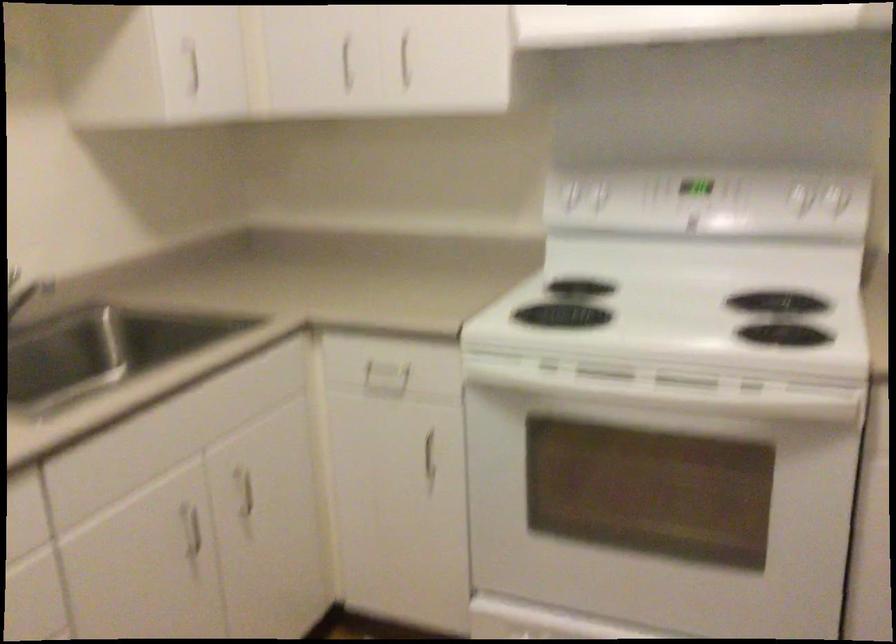
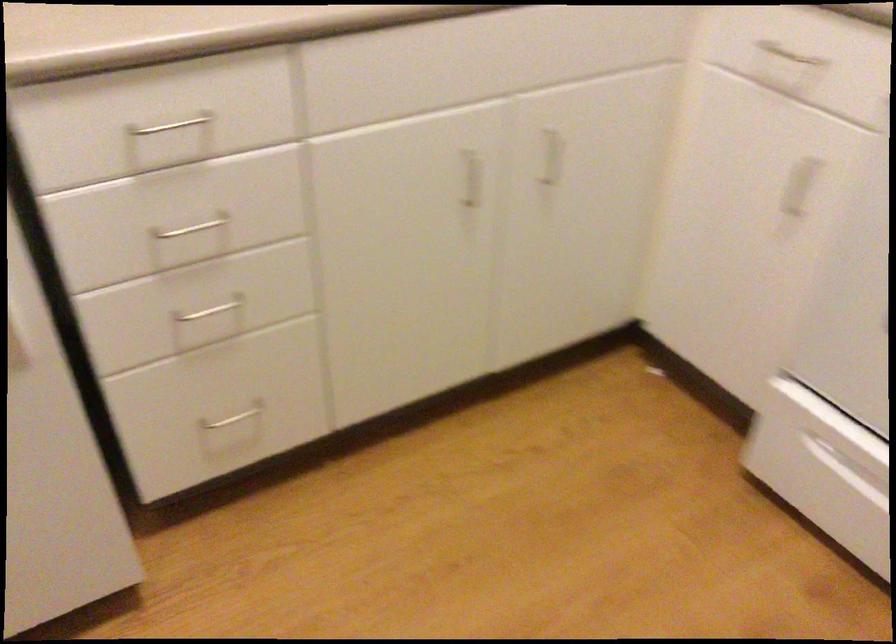
The point at (185, 527) is marked in the first image. Where is the corresponding point in the second image?

(471, 178)